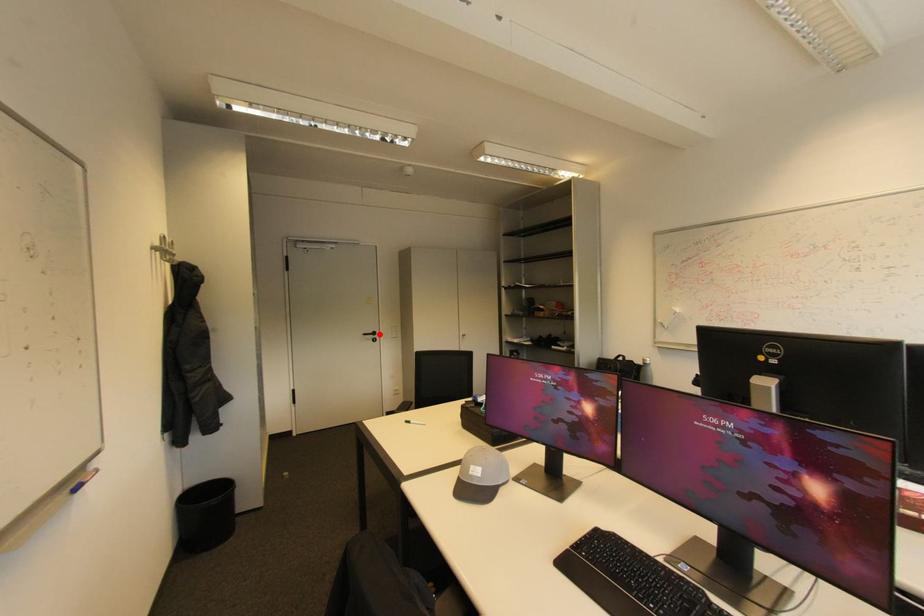
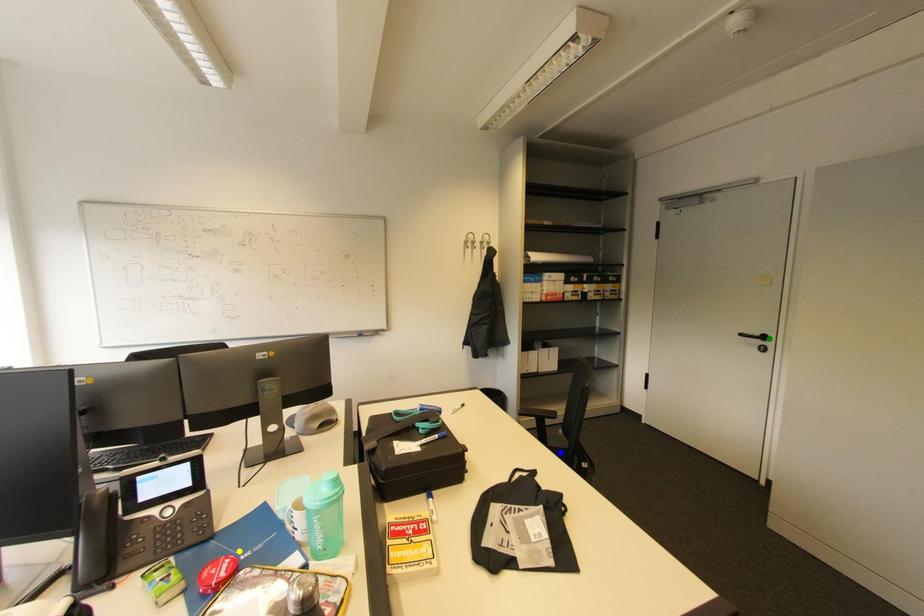
Question: I am providing you with two images of the same scene from different viewpoints. A red point is marked on the first image. You are given multiple points on the second image. Which point in image 2 is actually the same real-world point as the red point in image 1?

Choices:
 (A) blue point
 (B) yellow point
 (C) green point

Answer: (C)